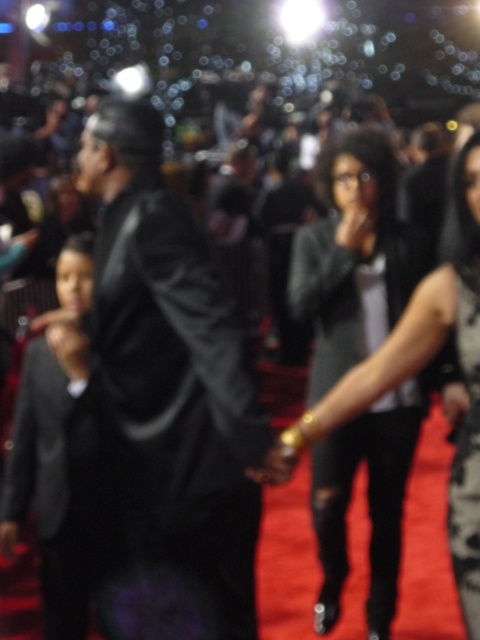
Question: Can you confirm if black leather suit at center is smaller than black satin dress at lower right?

Choices:
 (A) no
 (B) yes

Answer: (A)

Question: In this image, where is black leather suit at center located relative to black satin dress at lower right?

Choices:
 (A) below
 (B) above

Answer: (B)

Question: Which point is closer to the camera?

Choices:
 (A) (456, 566)
 (B) (327, 564)

Answer: (A)

Question: Which object is the farthest from the black leather suit at center?

Choices:
 (A) leather jacket at center
 (B) black satin dress at lower right

Answer: (A)

Question: Which of the following is the closest to the observer?

Choices:
 (A) black leather suit at center
 (B) black satin dress at lower right
 (C) leather jacket at center

Answer: (A)

Question: Is black leather suit at center to the right of leather jacket at center from the viewer's perspective?

Choices:
 (A) no
 (B) yes

Answer: (A)